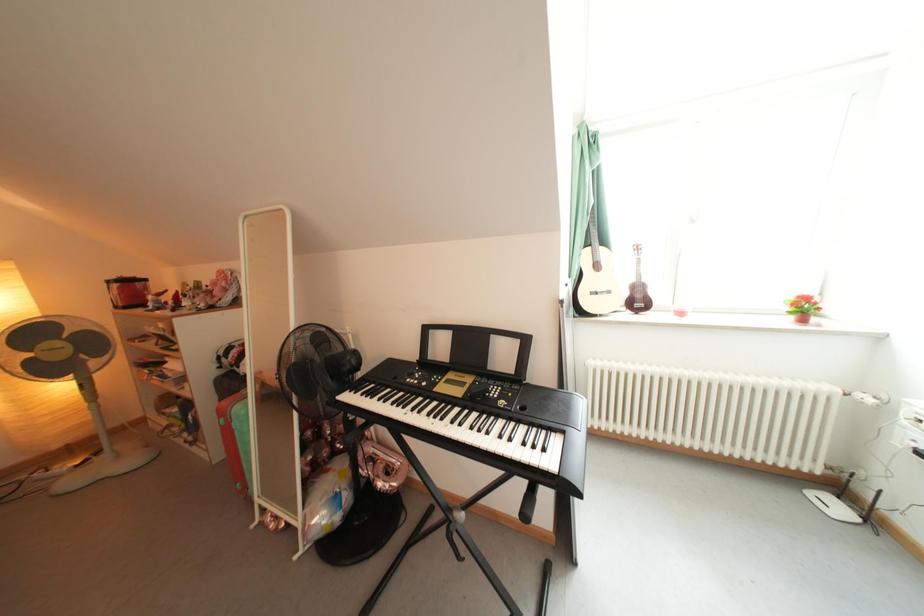
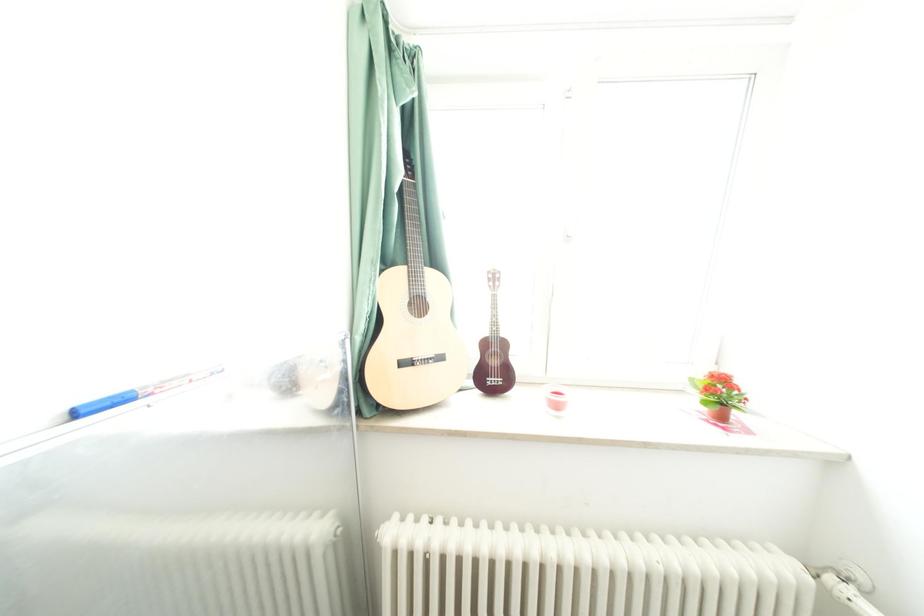
In the scene shown: In a continuous first-person perspective shot, in which direction is the camera moving?

The movement direction of the cameraman is right, forward.